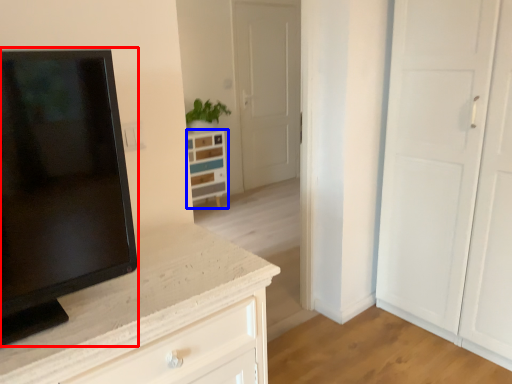
Question: Among these objects, which one is nearest to the camera, screen (highlighted by a red box) or chest of drawers (highlighted by a blue box)?

Choices:
 (A) screen
 (B) chest of drawers

Answer: (A)